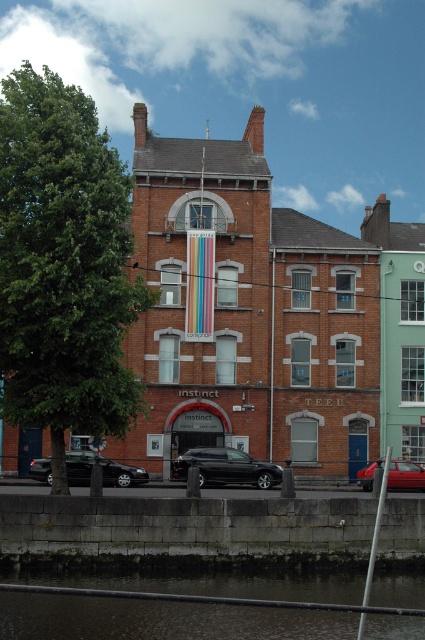
Does shiny black car at lower center have a greater width compared to shiny red car at lower right?

Yes.

Between point (260, 476) and point (416, 477), which one is positioned behind?

The point (260, 476) is behind.

Which is behind, point (243, 465) or point (405, 483)?

Positioned behind is point (243, 465).

At what (x,y) coordinates should I click in order to perform the action: click on shiny black car at lower center. Please return your answer as a coordinate pair (x, y). This screenshot has width=425, height=640. Looking at the image, I should click on [226, 467].

Can you confirm if dark water at lower center is wider than shiny red car at lower right?

Correct, the width of dark water at lower center exceeds that of shiny red car at lower right.

Is the position of dark water at lower center more distant than that of shiny red car at lower right?

No, it is in front of shiny red car at lower right.

Between point (359, 614) and point (371, 477), which one is positioned in front?

Positioned in front is point (359, 614).

The height and width of the screenshot is (640, 425). What are the coordinates of `dark water at lower center` in the screenshot? It's located at (161, 620).

Between point (22, 573) and point (110, 474), which one is positioned in front?

Point (22, 573) is more forward.

Does point (269, 618) lie behind point (87, 461)?

No, it is in front of (87, 461).

Is point (173, 604) more distant than point (124, 481)?

No, (173, 604) is closer to viewer.

The image size is (425, 640). Find the location of `dark water at lower center`. dark water at lower center is located at coordinates (161, 620).